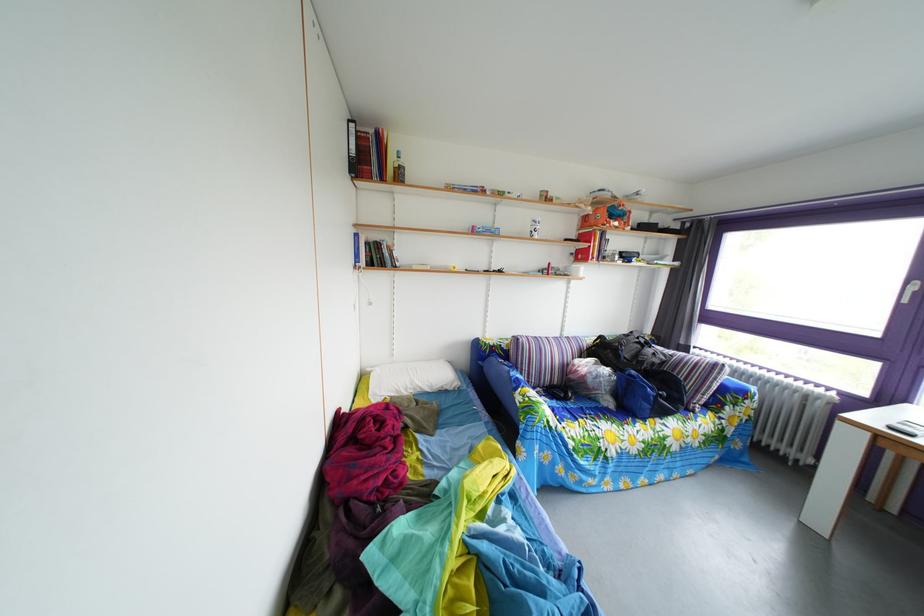
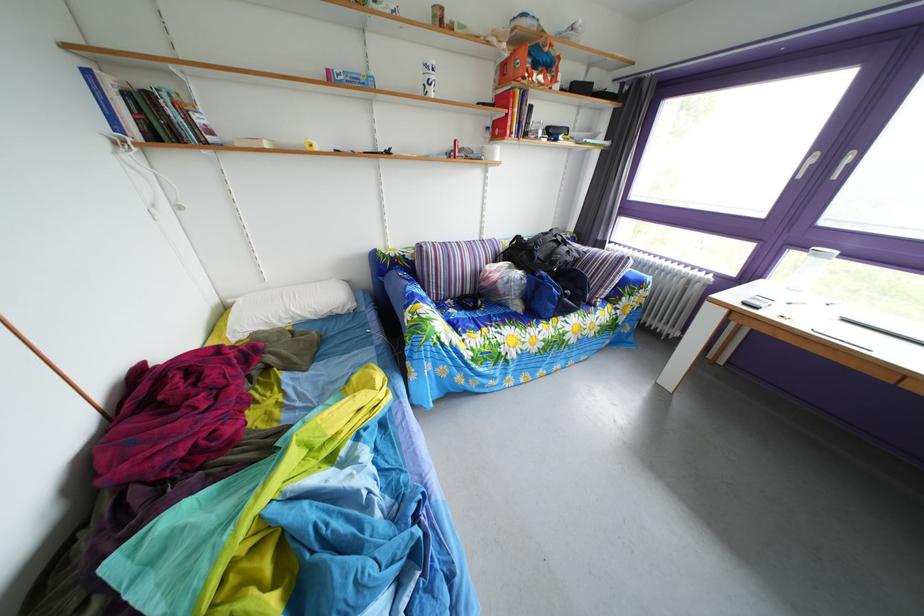
Question: The images are taken continuously from a first-person perspective. In which direction is your viewpoint rotating?

Choices:
 (A) Left
 (B) Right
 (C) Up
 (D) Down

Answer: (D)